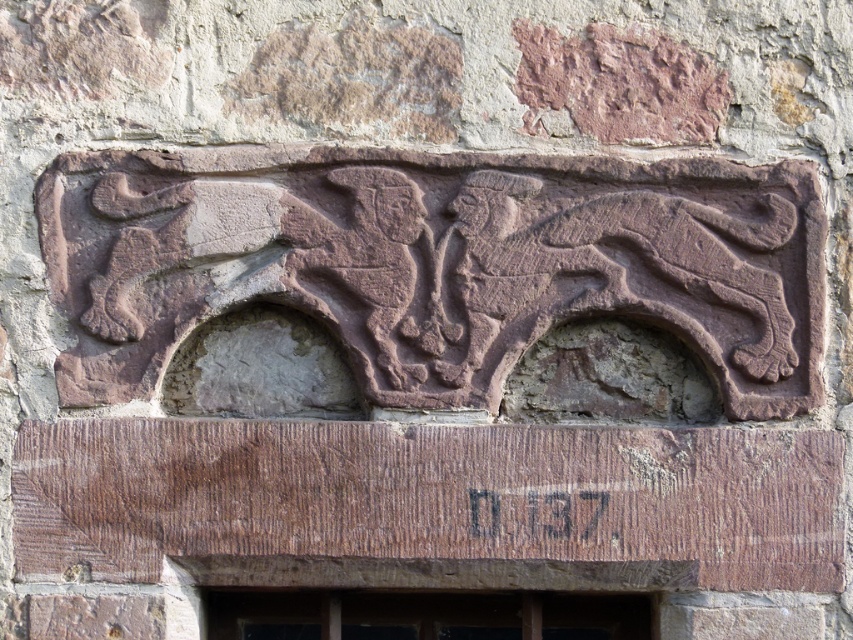
Based on the photo, you are an architect designing a new building and want to incorporate both the rustic stone carving at center and the transparent glass window at lower center into the design. Given their sizes, which object should you place higher up on the wall to maintain visual balance?

The rustic stone carving at center is much taller than the transparent glass window at lower center, so to maintain visual balance, the taller rustic stone carving at center should be placed higher up on the wall while the smaller transparent glass window at lower center can be positioned lower.

You are an art conservator examining the stone wall. You need to determine which object, the rustic stone carving at center or the brown stone plaque at center, requires more space for restoration. Based on their sizes, which one should you prioritize?

The rustic stone carving at center is larger in size than the brown stone plaque at center, so it requires more space for restoration and should be prioritized.